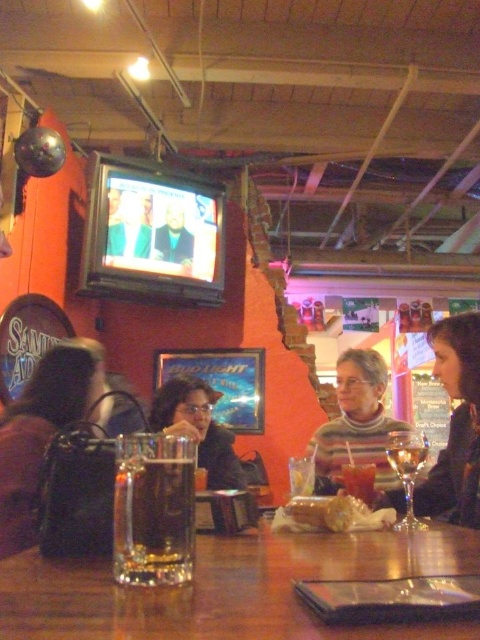
Is point (285, 516) positioned in front of point (370, 474)?

Yes, it is in front of point (370, 474).

Which of these two, translucent plastic bag at center or translucent glass drink at center, stands shorter?

translucent glass drink at center

Which is behind, point (325, 525) or point (345, 490)?

The point (345, 490) is more distant.

At what (x,y) coordinates should I click in order to perform the action: click on translucent plastic bag at center. Please return your answer as a coordinate pair (x, y). Looking at the image, I should click on (331, 515).

Is point (147, 545) positioned after point (312, 504)?

No.

Which is in front, point (132, 520) or point (300, 522)?

Point (132, 520) is in front.

At what (x,y) coordinates should I click in order to perform the action: click on translucent glass mug at center. Please return your answer as a coordinate pair (x, y). Image resolution: width=480 pixels, height=640 pixels. Looking at the image, I should click on (154, 520).

Does point (36, 536) come behind point (212, 460)?

No, it is in front of (212, 460).

Does matte black purse at left appear under matte black hair at center?

Incorrect, matte black purse at left is not positioned below matte black hair at center.

The image size is (480, 640). I want to click on matte black purse at left, so click(x=44, y=429).